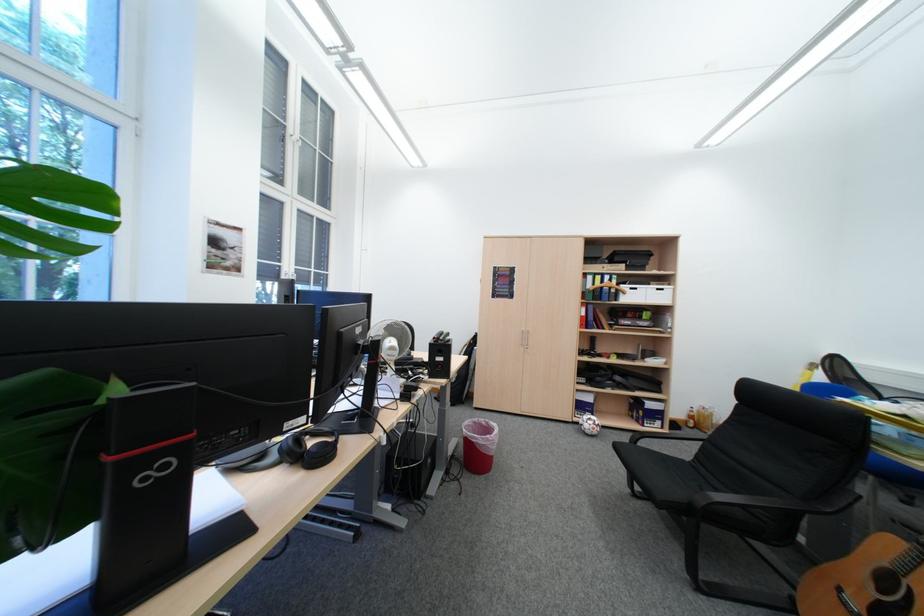
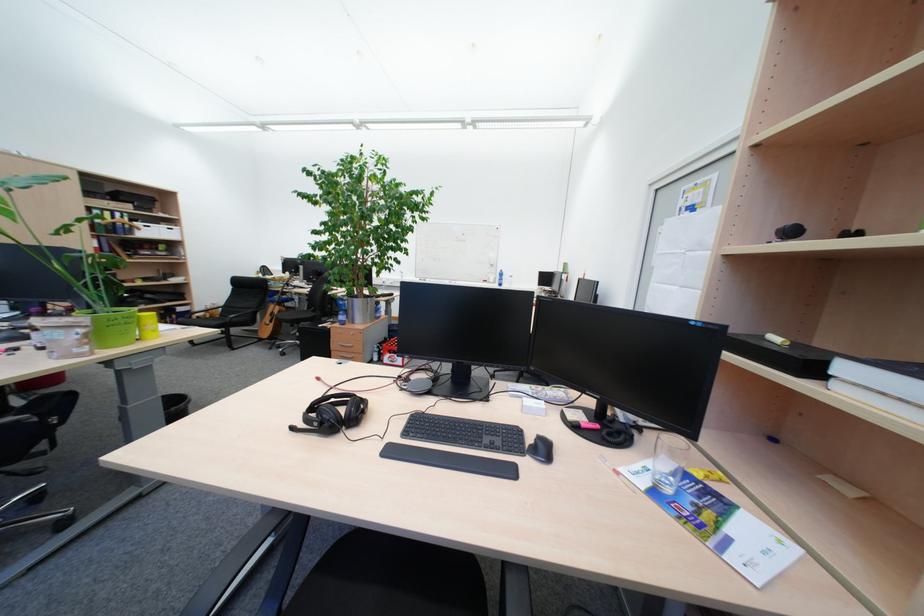
In the second image, find the point that corresponds to pixel 824 368 in the first image.

(271, 274)